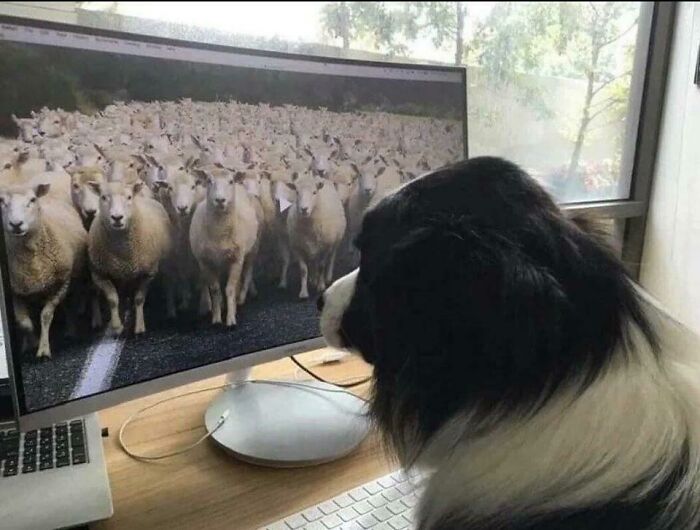
Find the location of a particular element. keyboards is located at coordinates (45, 453), (378, 502).